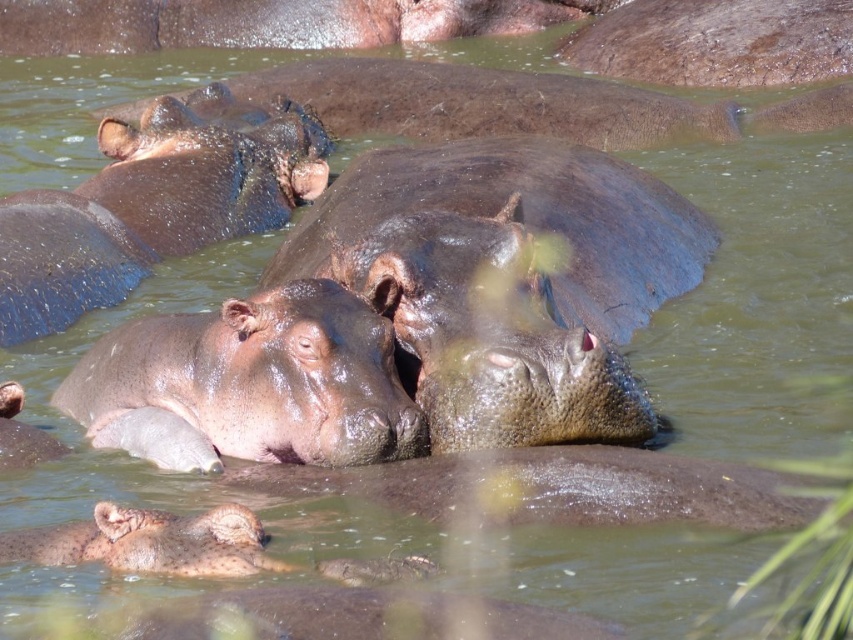
Can you confirm if slick gray hippo at center is positioned to the left of smooth gray hippo at lower center?

In fact, slick gray hippo at center is to the right of smooth gray hippo at lower center.

Is point (433, 515) less distant than point (267, 628)?

No.

Find the location of a particular element. slick gray hippo at center is located at coordinates (558, 486).

Which is above, smooth brown hippo at upper center or smooth gray hippo at lower center?

smooth brown hippo at upper center is above.

Image resolution: width=853 pixels, height=640 pixels. Describe the element at coordinates (265, 22) in the screenshot. I see `smooth brown hippo at upper center` at that location.

You are a GUI agent. You are given a task and a screenshot of the screen. Output one action in this format:
    pyautogui.click(x=<x>, y=<y>)
    Task: Click on the smooth brown hippo at upper center
    Image resolution: width=853 pixels, height=640 pixels.
    Given the screenshot: What is the action you would take?
    pyautogui.click(x=265, y=22)

How much distance is there between slick brown hippo at upper center and smooth gray hippo at lower center?

slick brown hippo at upper center and smooth gray hippo at lower center are 2.36 meters apart from each other.

Who is shorter, slick brown hippo at upper center or smooth gray hippo at lower center?

Standing shorter between the two is smooth gray hippo at lower center.

Who is more forward, (x=231, y=132) or (x=575, y=620)?

Positioned in front is point (x=575, y=620).

At what (x,y) coordinates should I click in order to perform the action: click on slick brown hippo at upper center. Please return your answer as a coordinate pair (x, y). This screenshot has width=853, height=640. Looking at the image, I should click on (148, 209).